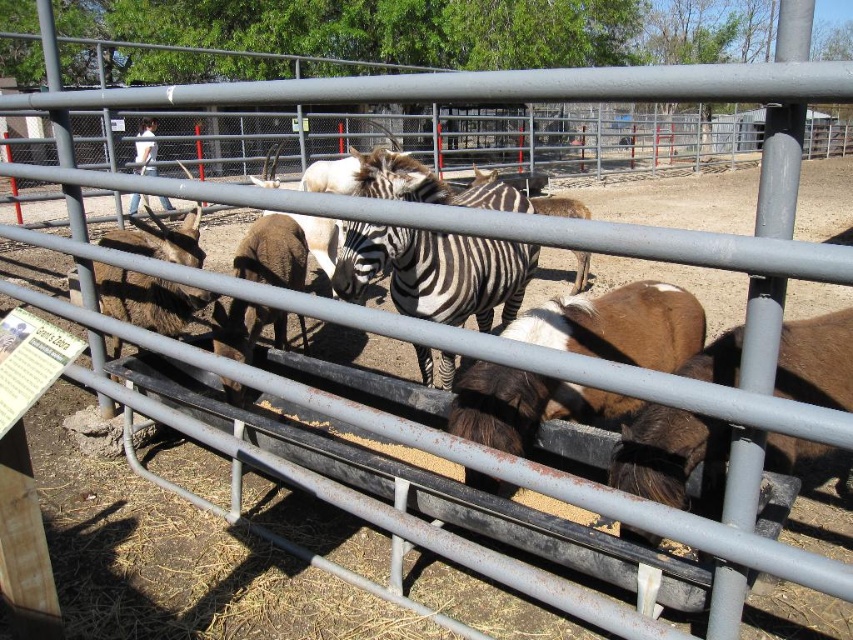
Which of these two, brown fuzzy goat at center or black and white striped zebra at center, stands taller?

Standing taller between the two is black and white striped zebra at center.

Is point (689, 340) positioned after point (531, 253)?

No, it is not.

In order to click on brown fuzzy goat at center in this screenshot , I will do `click(619, 324)`.